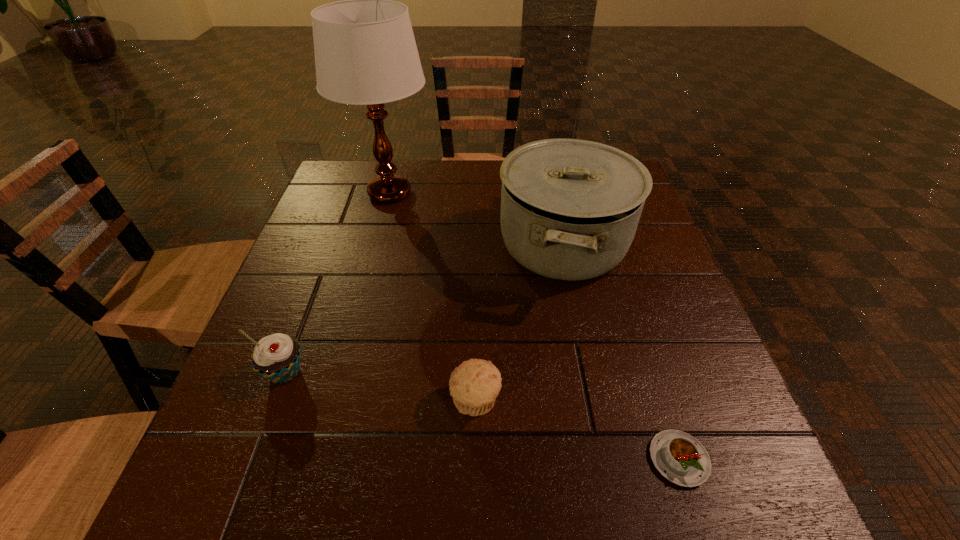
The width and height of the screenshot is (960, 540). I want to click on free spot between the third tallest object and the second shortest object, so click(x=380, y=387).

Find the location of a particular element. This screenshot has width=960, height=540. vacant space in between the pudding and the fourth shortest object is located at coordinates (621, 352).

Identify the location of vacant region between the muffin and the tallest object. (433, 297).

At what (x,y) coordinates should I click in order to perform the action: click on free space between the cupcake and the tallest object. Please return your answer as a coordinate pair (x, y). Looking at the image, I should click on (337, 283).

This screenshot has width=960, height=540. What are the coordinates of `free space between the third shortest object and the nearest object` in the screenshot? It's located at (482, 416).

The image size is (960, 540). In order to click on free spot between the pudding and the muffin in this screenshot , I will do `click(577, 430)`.

Identify the location of vacant space that is in between the pudding and the saucepan. (621, 352).

At what (x,y) coordinates should I click in order to perform the action: click on free space between the table lamp and the third shortest object. Please return your answer as a coordinate pair (x, y). This screenshot has height=540, width=960. Looking at the image, I should click on (337, 283).

The width and height of the screenshot is (960, 540). I want to click on object that stands as the fourth closest to the nearest object, so click(x=365, y=52).

Image resolution: width=960 pixels, height=540 pixels. Identify the location of object that is the fourth closest to the tallest object. (682, 459).